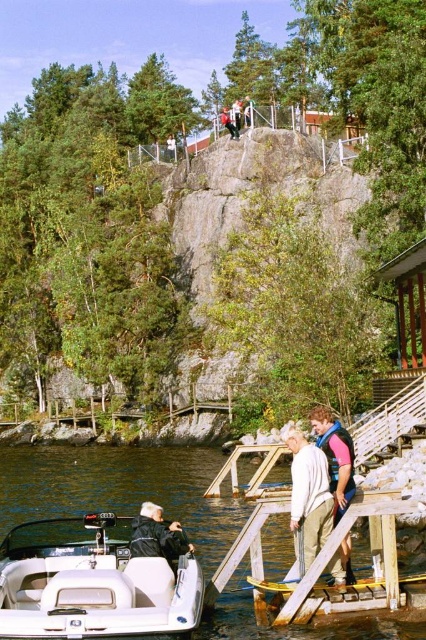
You are a visitor at the lakeside and want to take a photo of the clear water at lower left and the black leather jacket at lower center. Which object should you focus on first if you want to capture both in one frame without moving the camera?

The clear water at lower left is positioned on the left side of black leather jacket at lower center, so you should focus on the clear water at lower left first to ensure both are in frame.